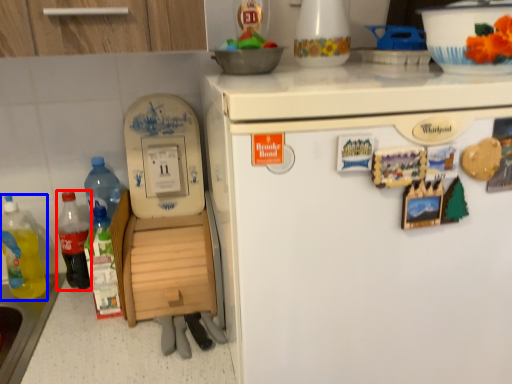
Question: Which of the following is the closest to the observer, bottle (highlighted by a red box) or bottle (highlighted by a blue box)?

Choices:
 (A) bottle
 (B) bottle

Answer: (B)